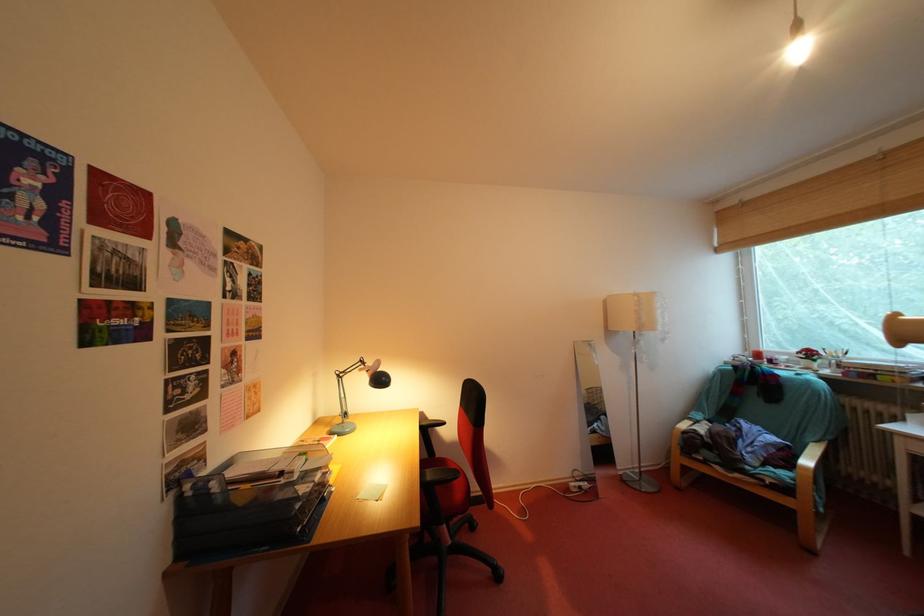
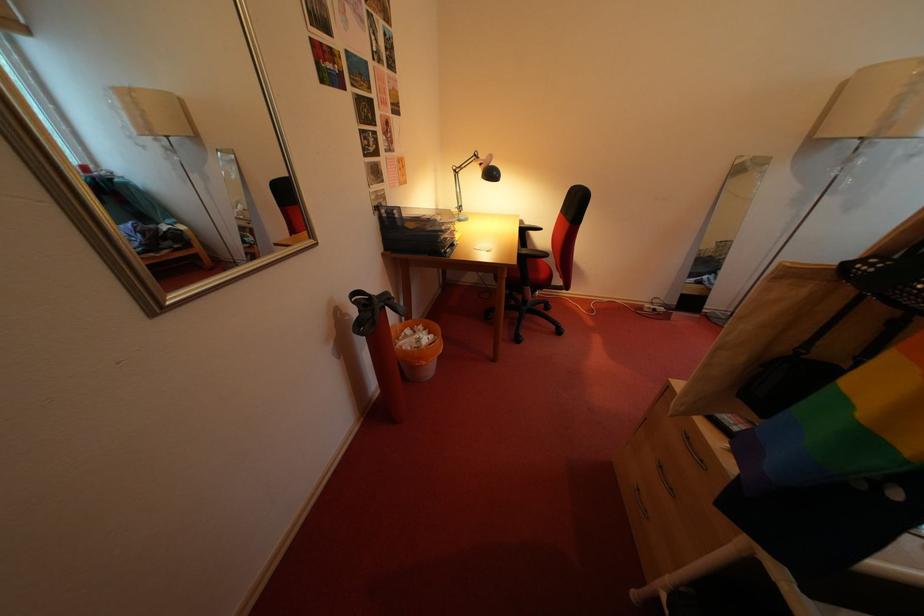
The point at (331, 419) is marked in the first image. Where is the corresponding point in the second image?

(451, 214)